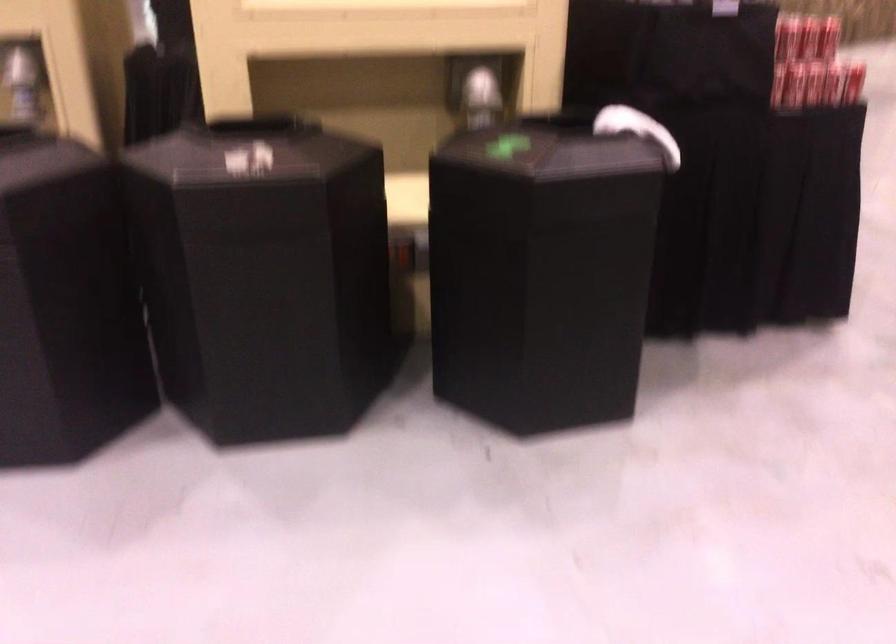
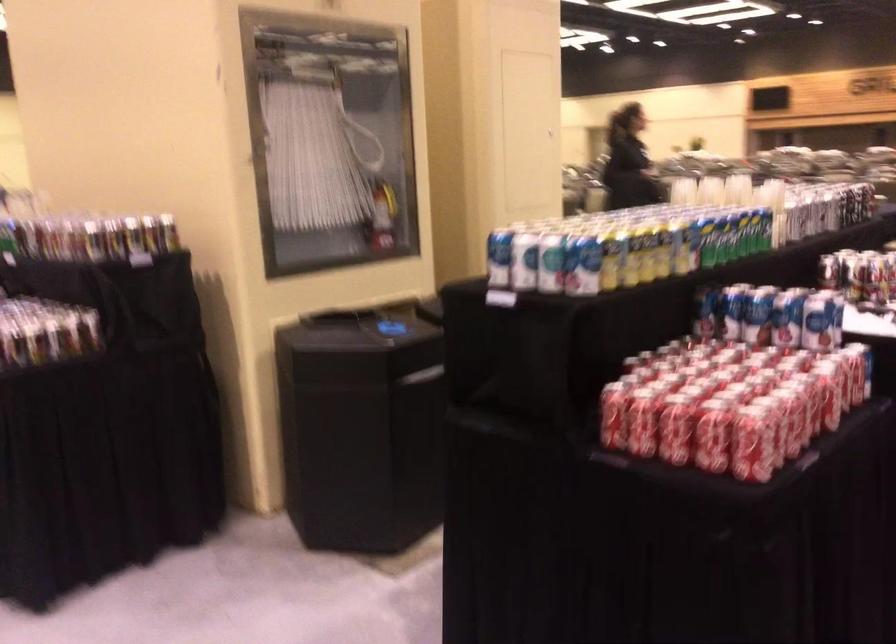
Question: I am providing you with two images of the same scene from different viewpoints. Please identify which objects are invisible in image2.

Choices:
 (A) black trash can lid
 (B) red soda can
 (C) utensil handle
 (D) fire hose nozzle

Answer: (A)